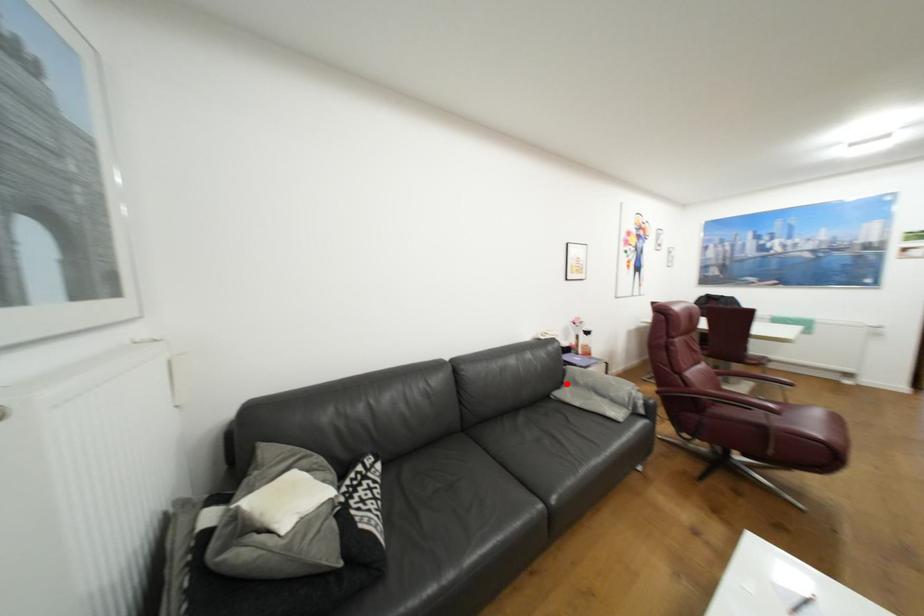
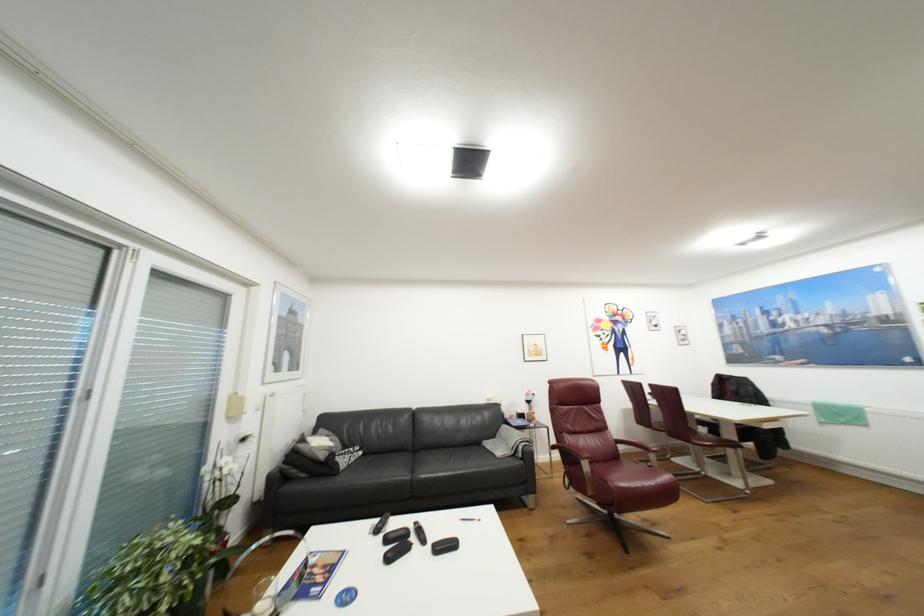
Where in the second image is the point corresponding to the highlighted location from the first image?

(500, 437)